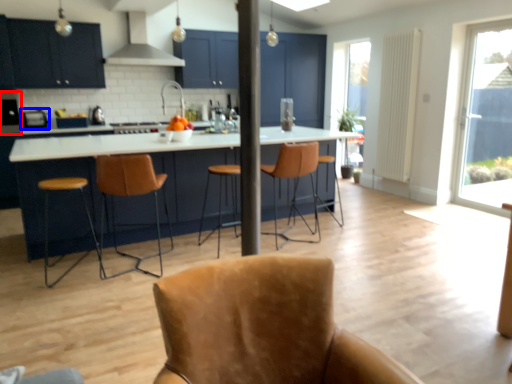
Question: Which point is further to the camera, appliance (highlighted by a red box) or appliance (highlighted by a blue box)?

Choices:
 (A) appliance
 (B) appliance

Answer: (B)